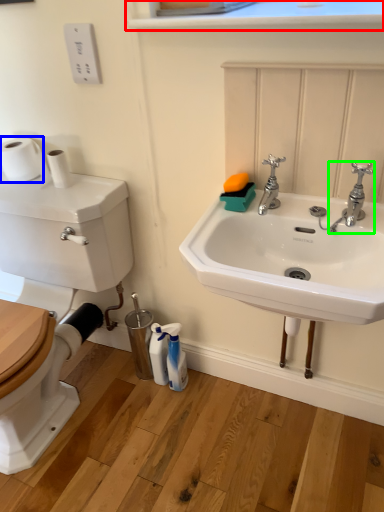
Question: Based on their relative distances, which object is nearer to window sill (highlighted by a red box)? Choose from toilet paper (highlighted by a blue box) and tap (highlighted by a green box).

Choices:
 (A) toilet paper
 (B) tap

Answer: (B)